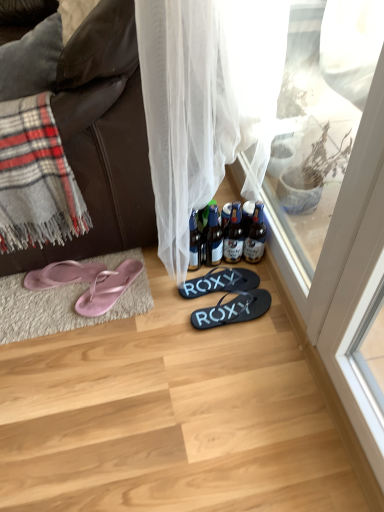
Question: Would you say brown glass bottles at center, which is the 1th bottle in right-to-left order, is to the left or to the right of pink rubber flip-flops at left, the fourth footwear from the right, in the picture?

Choices:
 (A) left
 (B) right

Answer: (B)

Question: From the image's perspective, is brown glass bottles at center, which is the 1th bottle in right-to-left order, located above or below pink rubber flip-flops at left, the fourth footwear from the right?

Choices:
 (A) below
 (B) above

Answer: (B)

Question: Estimate the real-world distances between objects in this image. Which object is closer to the pink rubber flip-flops at lower left, which appears as the second footwear when viewed from the left?

Choices:
 (A) translucent glass bottles at center, marked as the second bottle in a left-to-right arrangement
 (B) translucent glass bottle at center, the 4th bottle positioned from the right
 (C) gray plaid blanket at left
 (D) translucent glass bottle at center, which is counted as the 3th bottle, starting from the left
 (E) black rubber flip flops at center, which appears as the 1th footwear when viewed from the right

Answer: (B)

Question: Estimate the real-world distances between objects in this image. Which object is farther from the pink rubber flip-flops at left, the 1th footwear viewed from the left?

Choices:
 (A) translucent glass bottle at center, which is counted as the 3th bottle, starting from the left
 (B) black rubber flip flops at center, the third footwear when ordered from left to right
 (C) black rubber flip flops at center, acting as the 4th footwear starting from the left
 (D) translucent glass bottle at center, the 4th bottle positioned from the right
 (E) gray plaid blanket at left

Answer: (A)